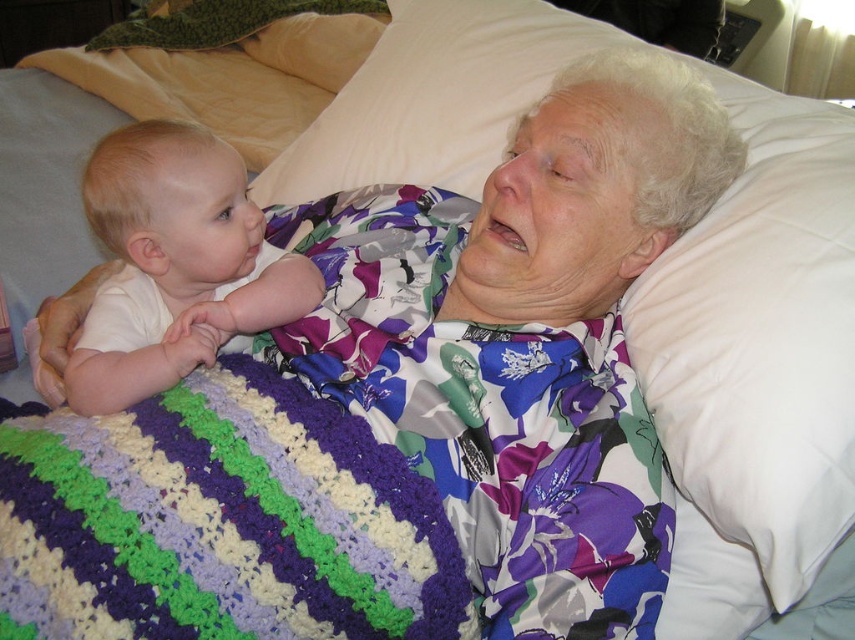
Does multicolored crocheted blanket at lower left lie behind white smooth baby at left?

No, multicolored crocheted blanket at lower left is in front of white smooth baby at left.

Based on the photo, between multicolored crocheted blanket at lower left and white smooth baby at left, which one has less height?

multicolored crocheted blanket at lower left is shorter.

Where is `multicolored crocheted blanket at lower left`? This screenshot has height=640, width=855. multicolored crocheted blanket at lower left is located at coordinates (233, 518).

Where is `multicolored crocheted blanket at lower left`? This screenshot has height=640, width=855. multicolored crocheted blanket at lower left is located at coordinates (233, 518).